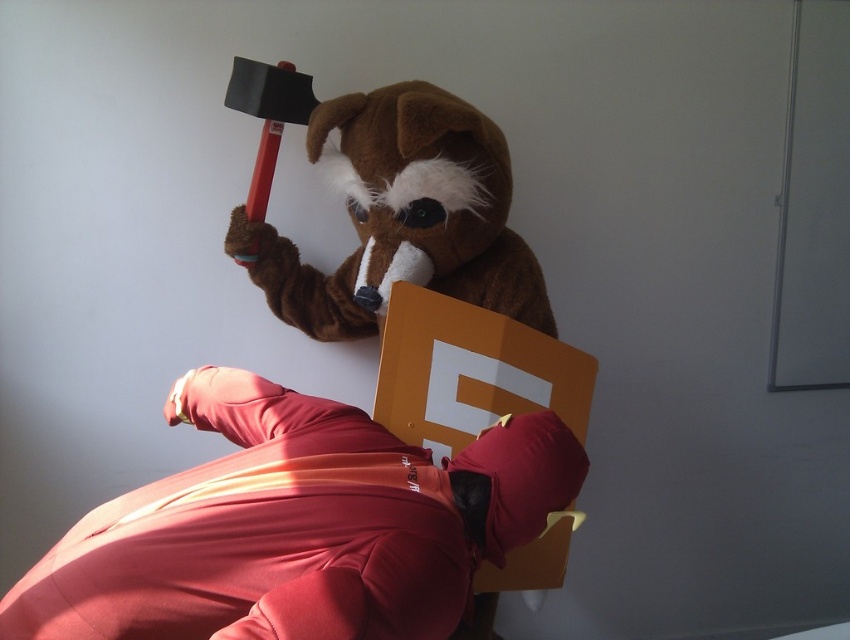
Question: Among these points, which one is nearest to the camera?

Choices:
 (A) (412, 445)
 (B) (446, 228)

Answer: (A)

Question: Which point is closer to the camera taking this photo?

Choices:
 (A) (350, 204)
 (B) (397, 476)

Answer: (B)

Question: Does matte red tracksuit at center appear on the right side of brown plush bear at upper center?

Choices:
 (A) yes
 (B) no

Answer: (B)

Question: Can you confirm if matte red tracksuit at center is positioned to the right of brown plush bear at upper center?

Choices:
 (A) no
 (B) yes

Answer: (A)

Question: Is matte red tracksuit at center to the left of brown plush bear at upper center from the viewer's perspective?

Choices:
 (A) no
 (B) yes

Answer: (B)